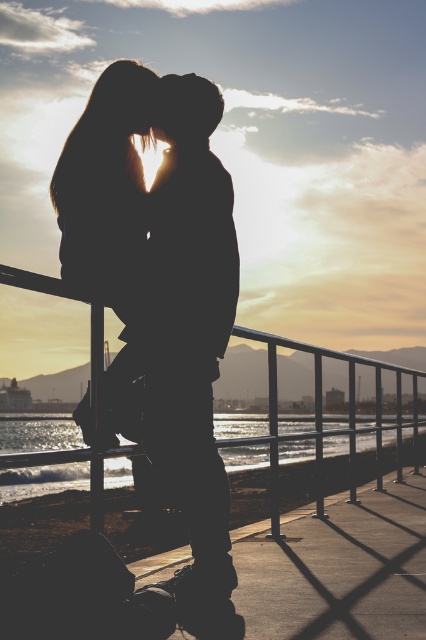
Question: Among these objects, which one is nearest to the camera?

Choices:
 (A) silhouette figure at center
 (B) metallic silver rail at center
 (C) glistening water at lower left

Answer: (B)

Question: Is silhouette figure at center bigger than metallic silver rail at center?

Choices:
 (A) yes
 (B) no

Answer: (B)

Question: Is metallic silver rail at center positioned before glistening water at lower left?

Choices:
 (A) no
 (B) yes

Answer: (B)

Question: Does silhouette figure at center appear on the right side of metallic silver rail at center?

Choices:
 (A) no
 (B) yes

Answer: (A)

Question: Which point is farther from the camera taking this photo?

Choices:
 (A) (285, 340)
 (B) (419, 429)

Answer: (B)

Question: Which of the following is the farthest from the observer?

Choices:
 (A) silhouette figure at center
 (B) metallic silver rail at center

Answer: (A)